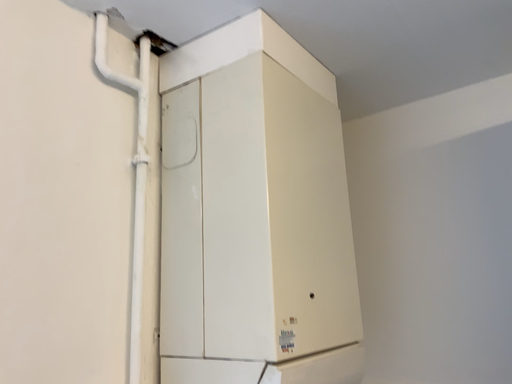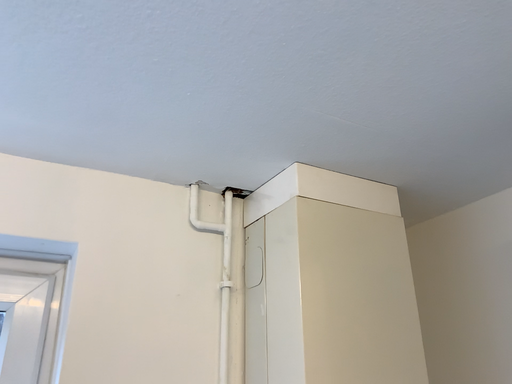
Question: How did the camera likely rotate when shooting the video?

Choices:
 (A) rotated downward
 (B) rotated upward

Answer: (B)